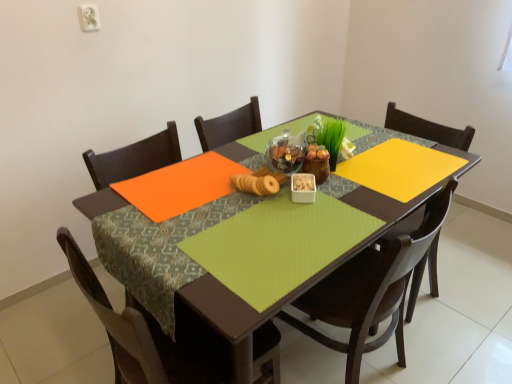
Image resolution: width=512 pixels, height=384 pixels. In order to click on vacant area that is in front of matte brown cookies at center in this screenshot , I will do [x=224, y=211].